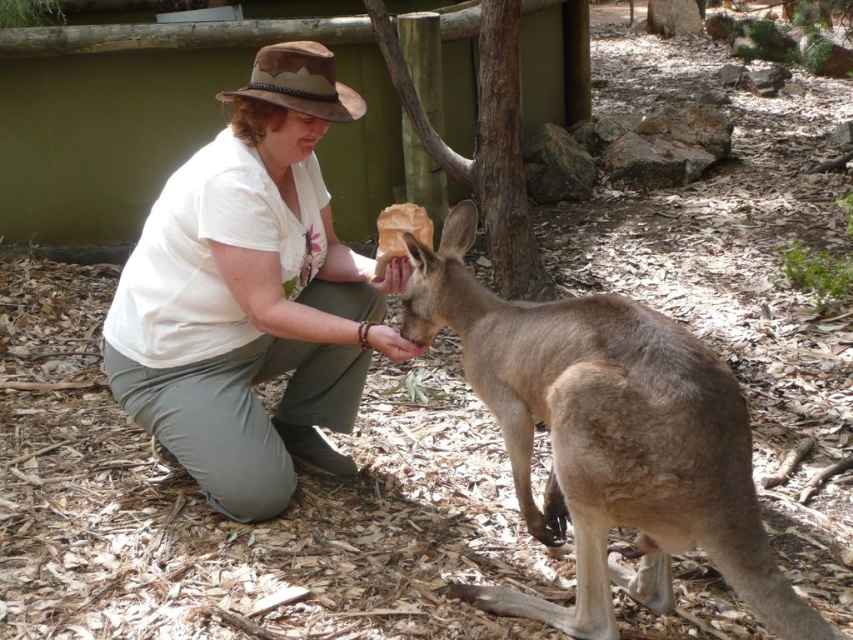
Consider the image. You are a zookeeper observing the interaction between the person and the kangaroo. Based on the scene, can you determine which object is located above the other between the white cotton shirt at center and the light brown fur at center?

The white cotton shirt at center is positioned over the light brown fur at center, meaning it is above the fur in the scene.

You are a zookeeper observing the interaction between the white cotton shirt at center and the light brown fur at center. Which object is located to the right?

The light brown fur at center is located to the right of the white cotton shirt at center.

You are a visitor at the zoo and want to take a photo of the white cotton shirt at center and the light brown fur at center. Which object should you focus on first to ensure both are in the same frame?

You should focus on the white cotton shirt at center first because it is closer to you than the light brown fur at center, allowing both to be in the same frame.